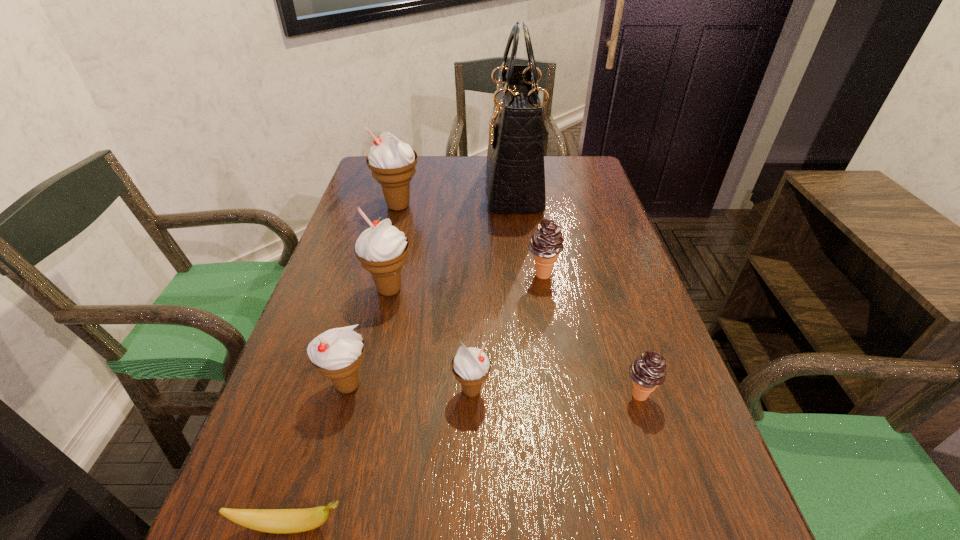
Find the location of a particular element. blank area at the far left corner is located at coordinates (371, 181).

Where is `free space at the far right corner`? The image size is (960, 540). free space at the far right corner is located at coordinates (592, 164).

Find the location of a particular element. vacant area that lies between the left chocolate icecream and the rightmost icecream is located at coordinates (590, 334).

I want to click on free space between the farthest white icecream and the left chocolate icecream, so click(470, 240).

Find the location of a particular element. The height and width of the screenshot is (540, 960). vacant space that's between the handbag and the third icecream from right to left is located at coordinates (492, 288).

The image size is (960, 540). What are the coordinates of `free space that is in between the nearest object and the fifth shortest icecream` in the screenshot? It's located at (340, 407).

Locate an element on the screen. The image size is (960, 540). vacant area between the shortest object and the left chocolate icecream is located at coordinates (417, 400).

Identify the location of free space between the handbag and the bigger chocolate icecream. This screenshot has width=960, height=540. (528, 230).

You are a GUI agent. You are given a task and a screenshot of the screen. Output one action in this format:
    pyautogui.click(x=<x>, y=<y>)
    Task: Click on the vacant area that lies between the tallest object and the fourth icecream from left to right
    This screenshot has width=960, height=540.
    Given the screenshot: What is the action you would take?
    pyautogui.click(x=492, y=288)

Where is `free spot between the second smallest white icecream and the tallest object`? free spot between the second smallest white icecream and the tallest object is located at coordinates (431, 286).